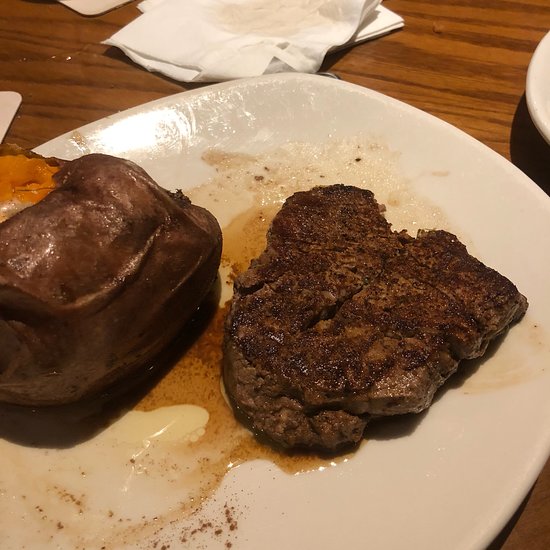
Image resolution: width=550 pixels, height=550 pixels. I want to click on edge of another plate, so point(537,82).